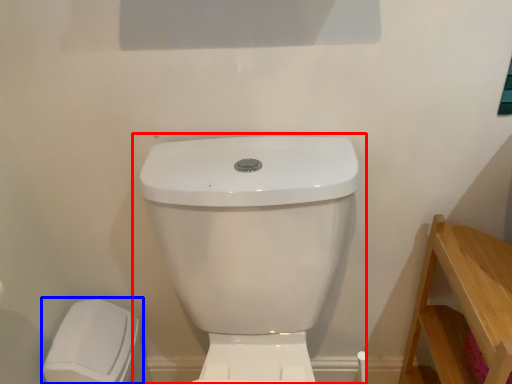
Question: Which object is closer to the camera taking this photo, toilet (highlighted by a red box) or porcelain (highlighted by a blue box)?

Choices:
 (A) toilet
 (B) porcelain

Answer: (A)